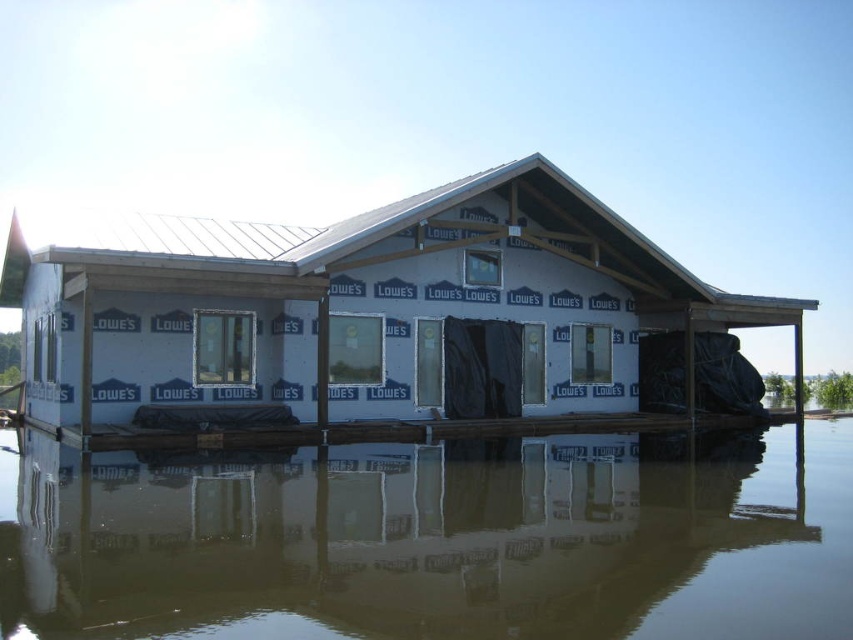
You are a construction worker standing on the white foam dock at center. Looking down, you see the brown murky water at lower center. Which object is closer to you?

The white foam dock at center is closer to you since you are standing on it, while the brown murky water at lower center is located below it.

You are a contractor standing on the white foam dock at center and need to reach the brown murky water at lower center to inspect the foundation. Which direction should you move to get there?

The brown murky water at lower center is to the left of the white foam dock at center, so you should move to the left to reach it.

You are a construction worker assessing the flooded area around the partially built house. You see the brown murky water at lower center and the white foam dock at center. Which of these two objects takes up more area in the image?

The white foam dock at center occupies more space than the brown murky water at lower center, so the dock takes up more area in the image.